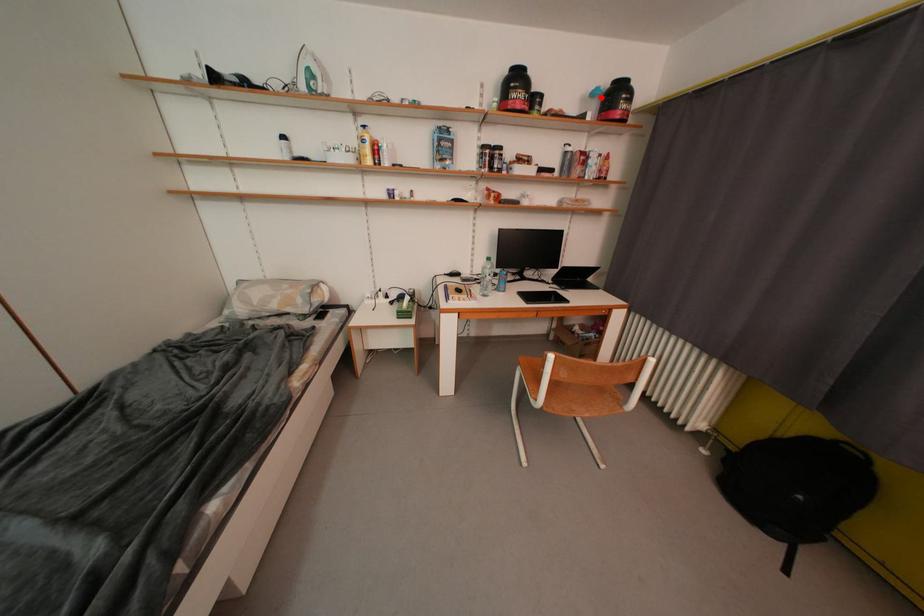
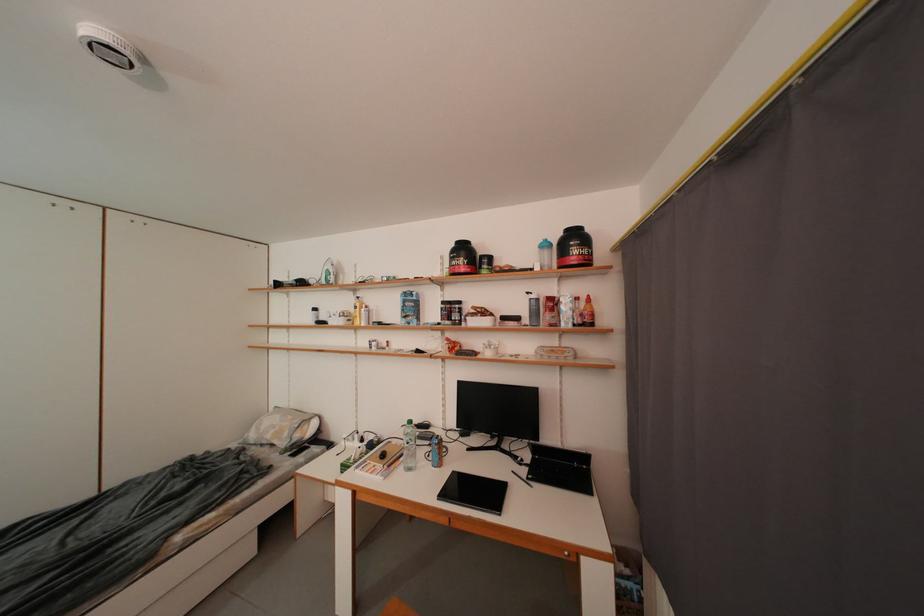
Locate, in the second image, the point that corresponds to the highlighted location in the first image.

(553, 249)